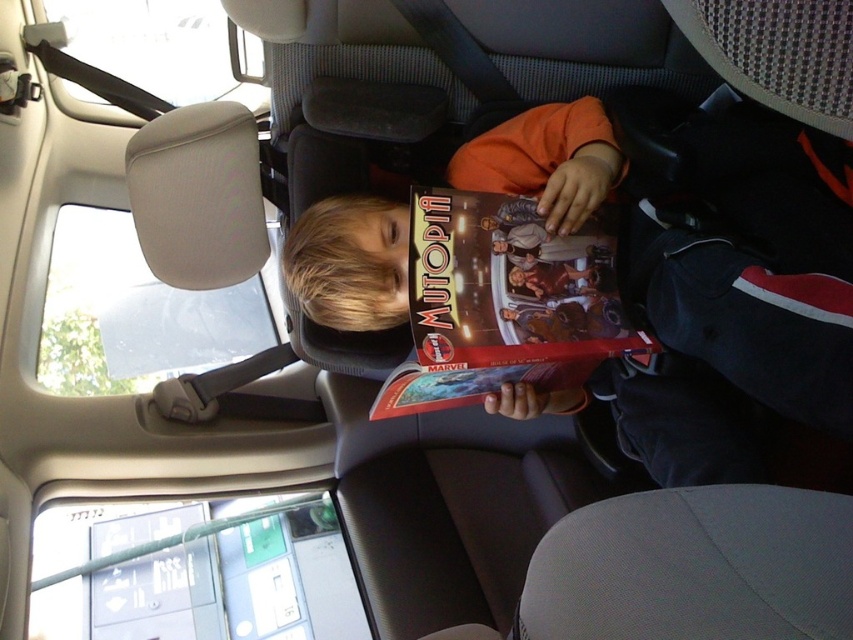
You are a parent in the driver seat of the vehicle. You want to place a new toy on the backseat where the child is sitting. The toy is 12 inches wide. The backseat has a matte orange book at center and a matte paper comic book at center. Can you determine if the toy will fit between the two books?

The matte orange book at center might be wider than matte paper comic book at center, so the space between them may not be sufficient for the 12 inch toy. Check the actual width before placing the toy.

You are a parent in the front seat of the vehicle and notice your child reading a book and a comic book. Which object is taller between the matte orange book at center and the matte paper comic book at center?

The matte orange book at center is taller than the matte paper comic book at center.

You are a parent in the driver seat of the vehicle. You want to hand your child a new toy that is placed on the dashboard. To reach it, you need to move either the matte orange book at center or the matte paper comic book at center. Which one should you move to access the dashboard?

The matte orange book at center is located above the matte paper comic book at center. To reach the dashboard, you should move the matte orange book at center since it is positioned higher and blocking the view to the dashboard.